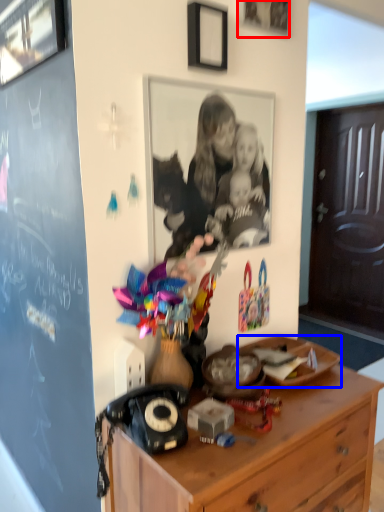
Question: Among these objects, which one is farthest to the camera, picture frame (highlighted by a red box) or plate (highlighted by a blue box)?

Choices:
 (A) picture frame
 (B) plate

Answer: (B)